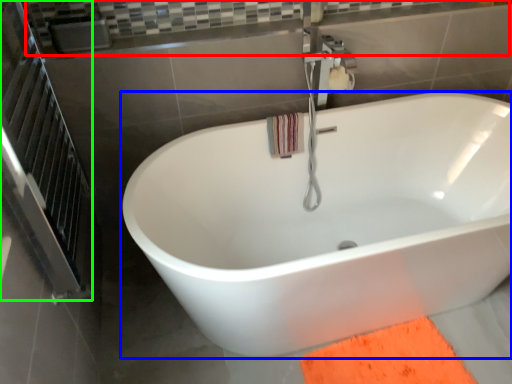
Question: Estimate the real-world distances between objects in this image. Which object is farther from balustrade (highlighted by a red box), bathtub (highlighted by a blue box) or screen door (highlighted by a green box)?

Choices:
 (A) bathtub
 (B) screen door

Answer: (A)